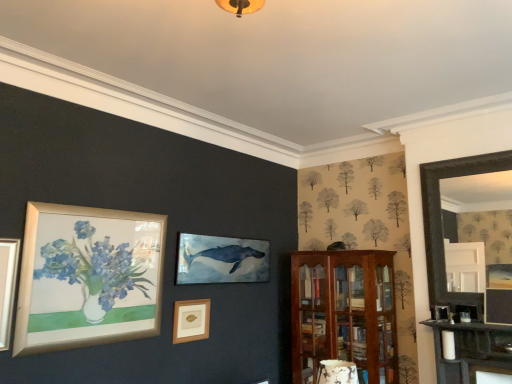
Question: Does black wooden fireplace at right have a lesser height compared to wooden picture frame at center?

Choices:
 (A) no
 (B) yes

Answer: (A)

Question: Considering the relative sizes of black wooden fireplace at right and wooden picture frame at center in the image provided, is black wooden fireplace at right bigger than wooden picture frame at center?

Choices:
 (A) yes
 (B) no

Answer: (A)

Question: Considering the relative positions of black wooden fireplace at right and wooden picture frame at center in the image provided, is black wooden fireplace at right in front of wooden picture frame at center?

Choices:
 (A) yes
 (B) no

Answer: (A)

Question: Is black wooden fireplace at right aimed at wooden picture frame at center?

Choices:
 (A) no
 (B) yes

Answer: (A)

Question: Is black wooden fireplace at right positioned behind wooden picture frame at center?

Choices:
 (A) no
 (B) yes

Answer: (A)

Question: Is wooden picture frame at center to the left or to the right of mahogany wooden cabinet at right in the image?

Choices:
 (A) left
 (B) right

Answer: (A)

Question: From a real-world perspective, is wooden picture frame at center positioned above or below mahogany wooden cabinet at right?

Choices:
 (A) below
 (B) above

Answer: (B)

Question: Considering the positions of wooden picture frame at center and mahogany wooden cabinet at right in the image, is wooden picture frame at center wider or thinner than mahogany wooden cabinet at right?

Choices:
 (A) thin
 (B) wide

Answer: (A)

Question: Considering their positions, is wooden picture frame at center located in front of or behind mahogany wooden cabinet at right?

Choices:
 (A) behind
 (B) front

Answer: (B)

Question: Based on their positions, is mahogany wooden cabinet at right located to the left or right of wooden picture frame at center?

Choices:
 (A) right
 (B) left

Answer: (A)

Question: Considering their positions, is mahogany wooden cabinet at right located in front of or behind wooden picture frame at center?

Choices:
 (A) behind
 (B) front

Answer: (A)

Question: Considering the positions of point (372, 256) and point (206, 309), is point (372, 256) closer or farther from the camera than point (206, 309)?

Choices:
 (A) farther
 (B) closer

Answer: (A)

Question: Is mahogany wooden cabinet at right bigger or smaller than wooden picture frame at center?

Choices:
 (A) big
 (B) small

Answer: (A)

Question: Is wooden picture frame at center inside the boundaries of black wooden fireplace at right, or outside?

Choices:
 (A) inside
 (B) outside

Answer: (B)

Question: Is point (196, 311) closer or farther from the camera than point (442, 254)?

Choices:
 (A) closer
 (B) farther

Answer: (B)